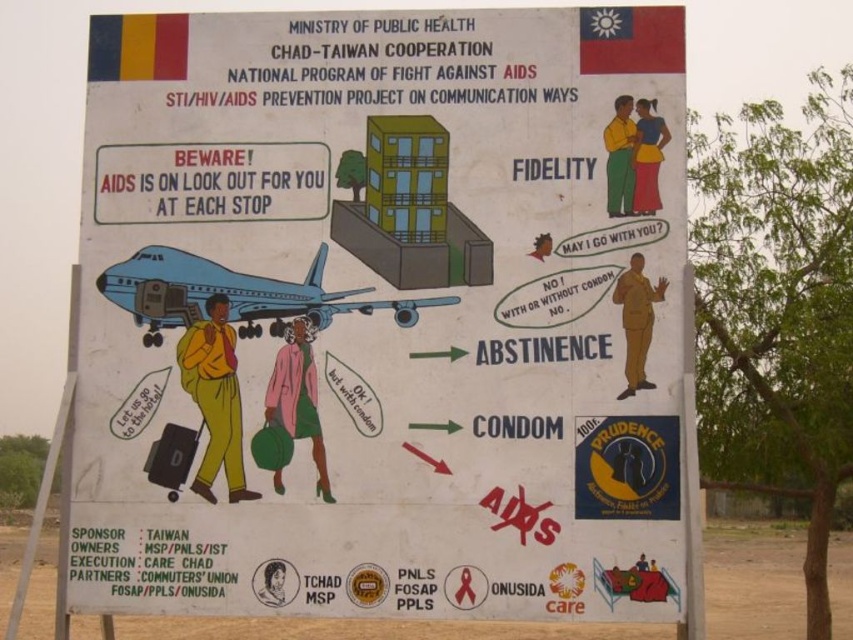
Question: Among these objects, which one is nearest to the camera?

Choices:
 (A) light blue glossy airplane at left
 (B) white paper poster at center

Answer: (B)

Question: Does white paper poster at center appear over light blue glossy airplane at left?

Choices:
 (A) yes
 (B) no

Answer: (B)

Question: In this image, where is white paper poster at center located relative to light blue glossy airplane at left?

Choices:
 (A) above
 (B) below

Answer: (B)

Question: Can you confirm if white paper poster at center is wider than light blue glossy airplane at left?

Choices:
 (A) yes
 (B) no

Answer: (A)

Question: Which object appears farthest from the camera in this image?

Choices:
 (A) white paper poster at center
 (B) light blue glossy airplane at left

Answer: (B)